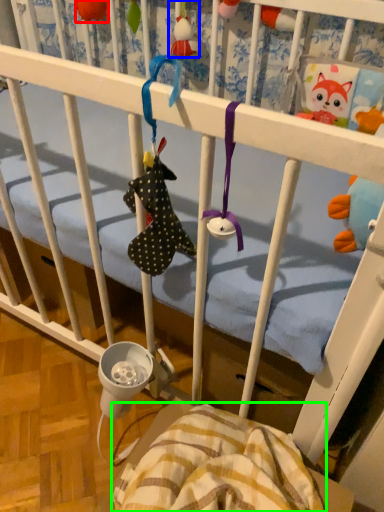
Question: Which object is the farthest from toy (highlighted by a red box)? Choose among these: toy (highlighted by a blue box) or blanket (highlighted by a green box).

Choices:
 (A) toy
 (B) blanket

Answer: (B)